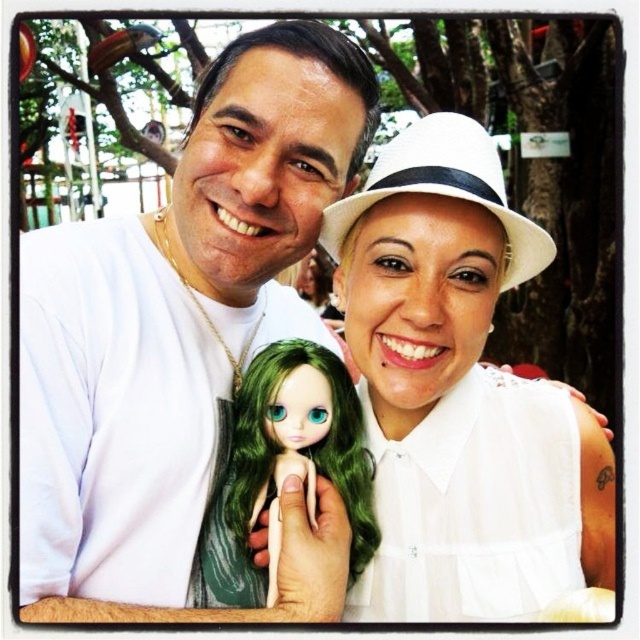
Question: Is the position of white pleated dress at center more distant than that of green porcelain doll at center?

Choices:
 (A) no
 (B) yes

Answer: (A)

Question: Among these points, which one is farthest from the camera?

Choices:
 (A) pos(524,388)
 (B) pos(296,436)
 (C) pos(349,314)

Answer: (A)

Question: Observing the image, what is the correct spatial positioning of white pleated dress at center in reference to green porcelain doll at center?

Choices:
 (A) right
 (B) left

Answer: (A)

Question: Is white pleated dress at center in front of green porcelain doll at center?

Choices:
 (A) yes
 (B) no

Answer: (A)

Question: Which of the following is the farthest from the observer?

Choices:
 (A) (477, 509)
 (B) (257, 486)

Answer: (B)

Question: Which object is closer to the camera taking this photo?

Choices:
 (A) white pleated dress at center
 (B) green porcelain doll at center

Answer: (A)